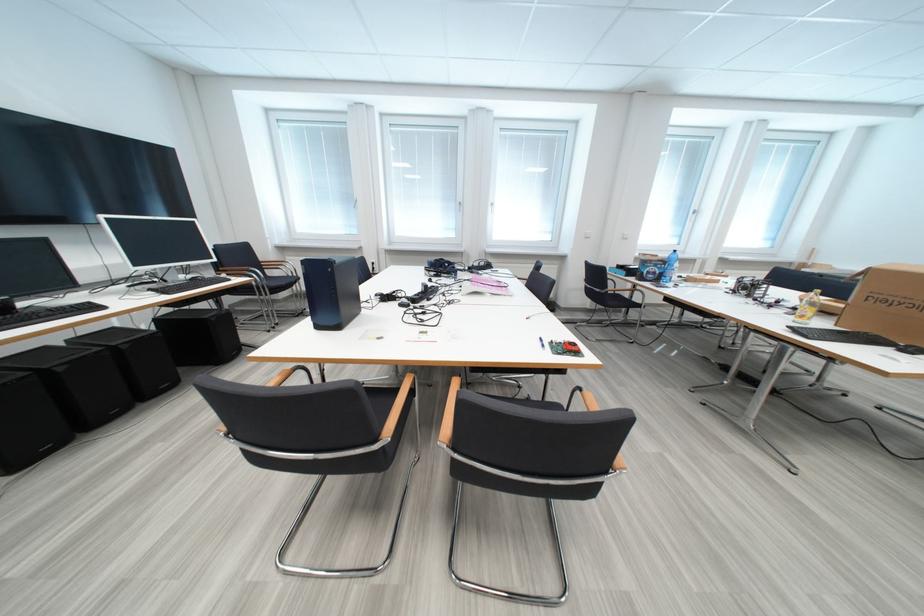
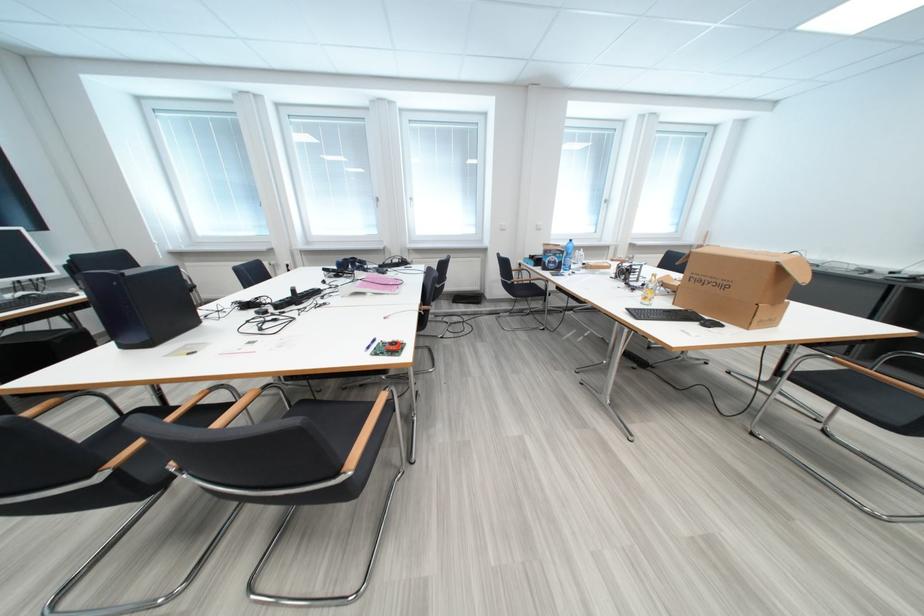
Find the pixel in the second image that matches point 329,330 in the first image.

(136, 349)